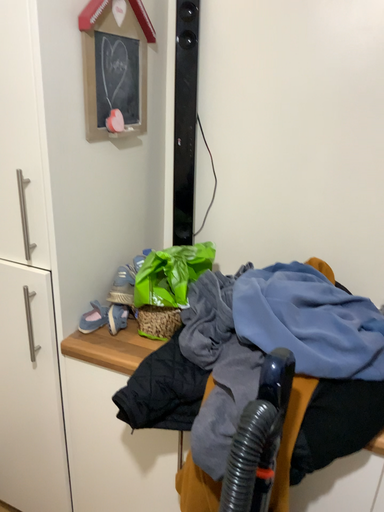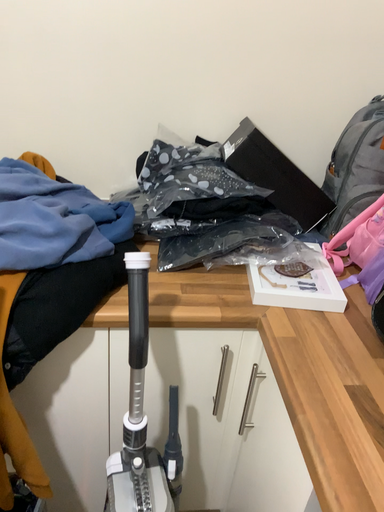
Question: How did the camera likely rotate when shooting the video?

Choices:
 (A) rotated upward
 (B) rotated downward

Answer: (B)